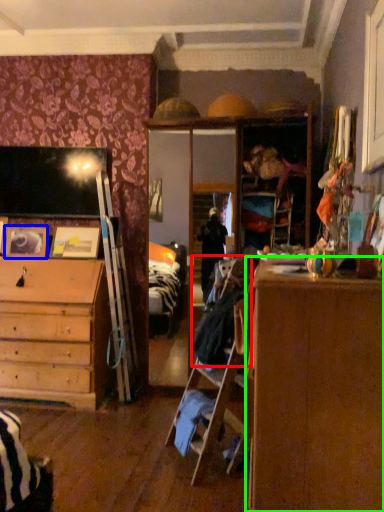
Question: Considering the real-world distances, which object is farthest from laundry (highlighted by a red box)? picture frame (highlighted by a blue box) or cabinetry (highlighted by a green box)?

Choices:
 (A) picture frame
 (B) cabinetry

Answer: (A)